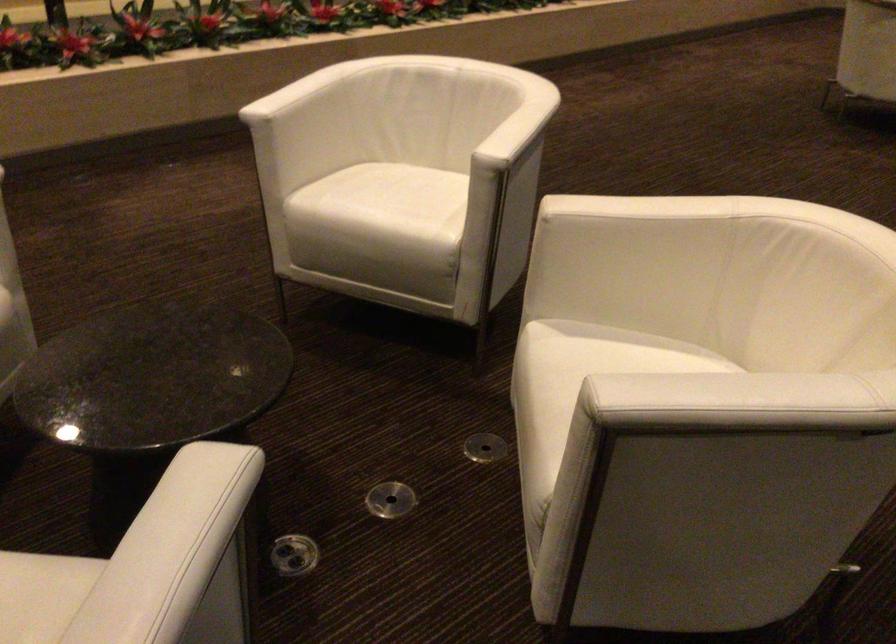
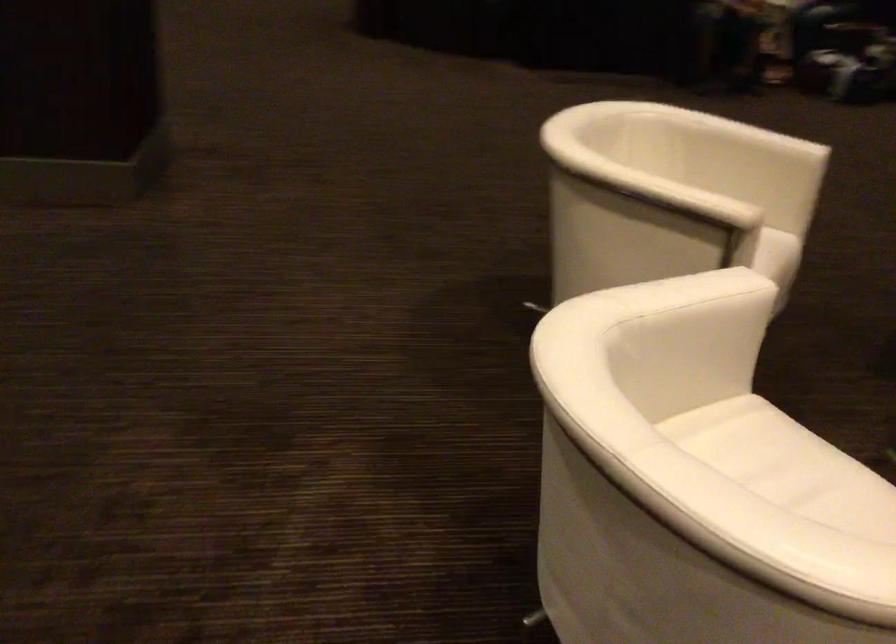
In the second image, find the point that corresponds to the point at 587,267 in the first image.

(676, 261)